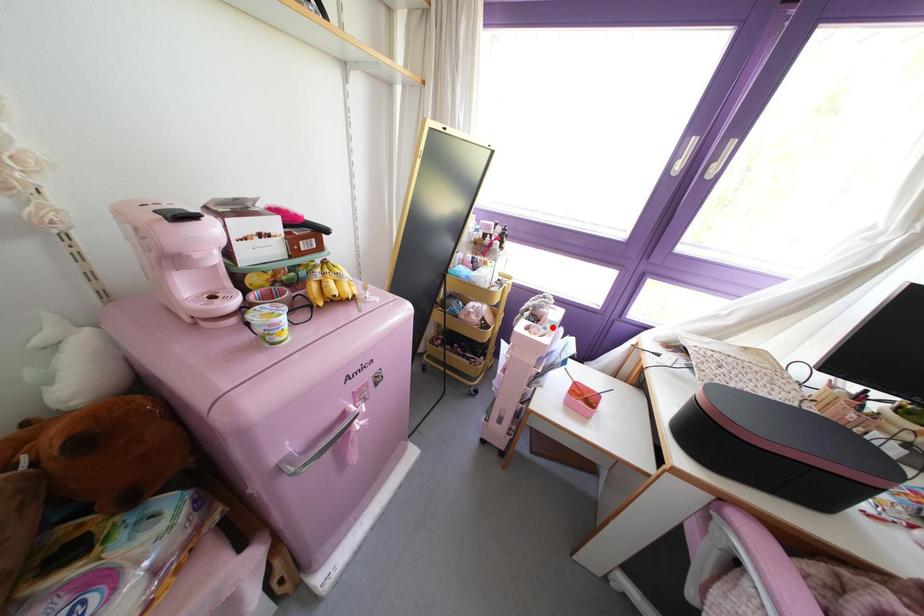
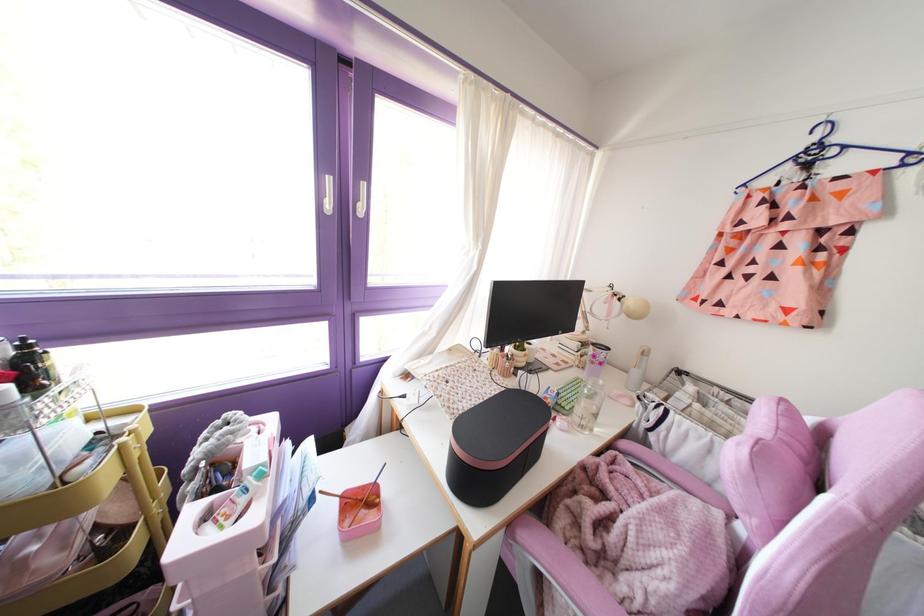
Locate, in the second image, the point that corresponds to the highlighted location in the first image.

(261, 475)